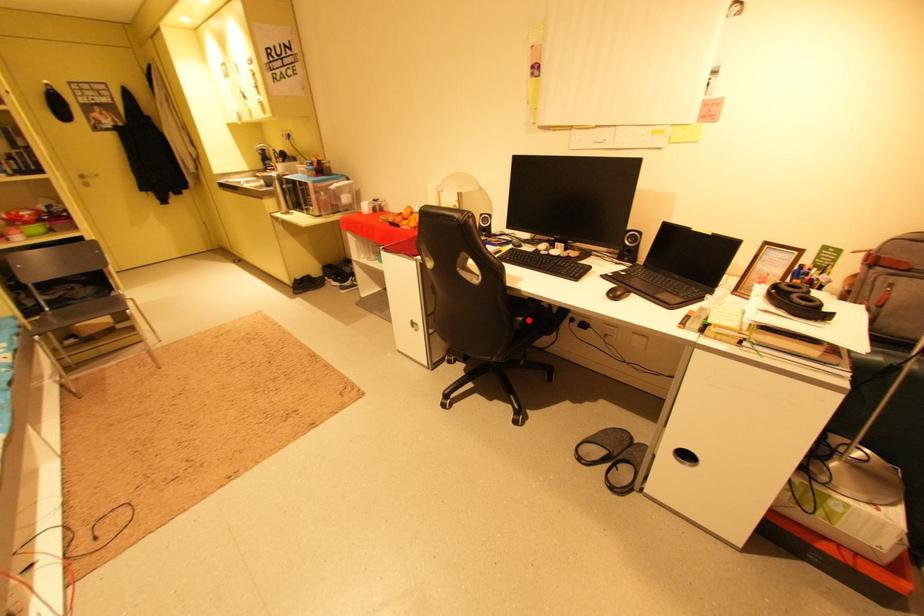
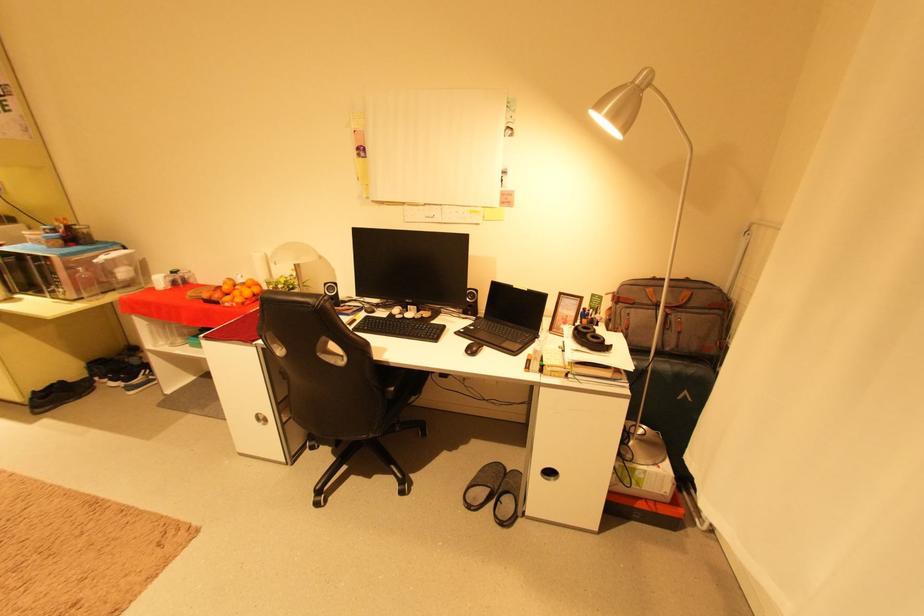
Question: I am providing you with two images of the same scene from different viewpoints. Image1 has a red point marked. In image2, the corresponding 3D location appears at what relative position? Reply with the corresponding letter.

Choices:
 (A) Closer
 (B) Farther

Answer: (A)